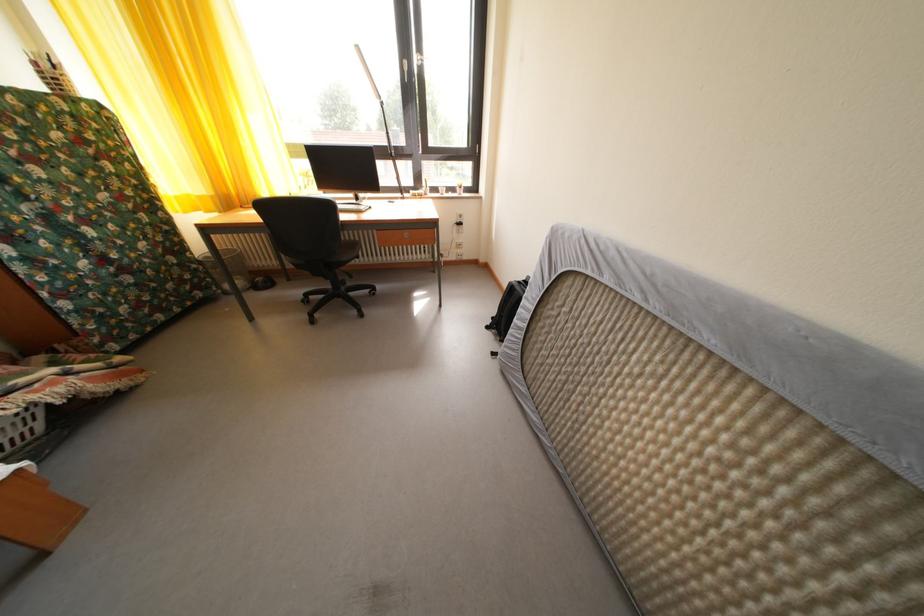
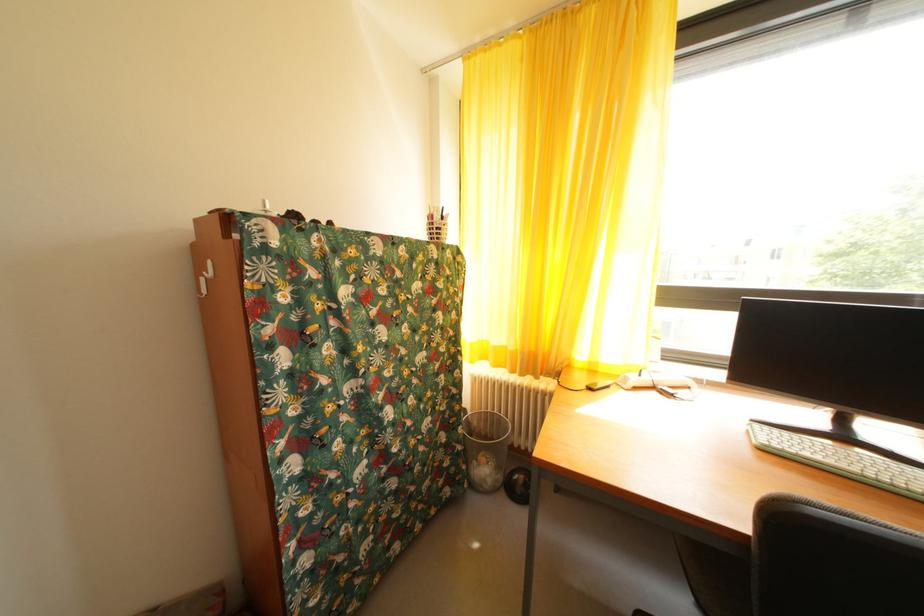
Find the pixel in the second image that matches point (209, 204) in the first image.

(505, 354)